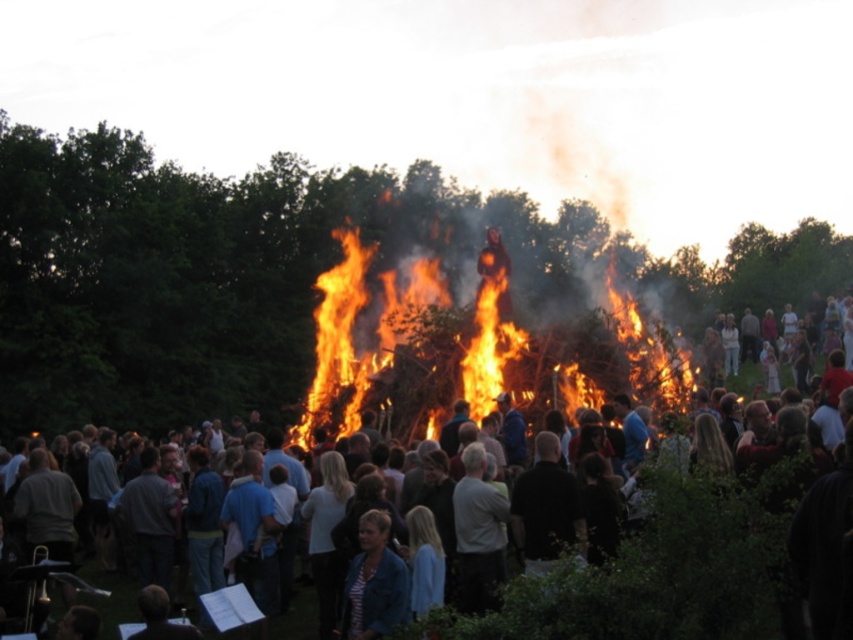
Where is the dark clothing crowd at center located in the image?

The dark clothing crowd at center is located at point [666,568].

You are at a bonfire event and want to join the dark clothing crowd at center. Which direction should you move relative to the flaming wood at center?

You should move to the right of the flaming wood at center to join the dark clothing crowd at center.